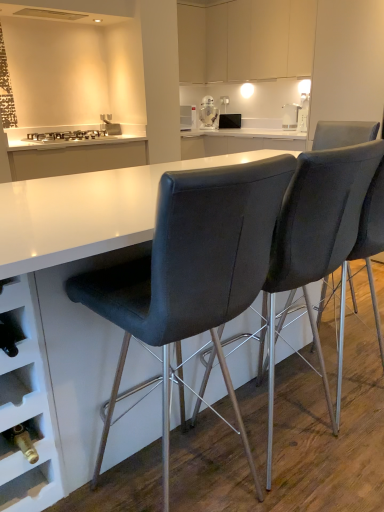
Question: Is white glossy stove at upper left thinner than matte black microwave at center, the first appliance when ordered from right to left?

Choices:
 (A) no
 (B) yes

Answer: (A)

Question: Considering the relative sizes of white glossy stove at upper left and matte black microwave at center, the 2th appliance from the left, in the image provided, is white glossy stove at upper left bigger than matte black microwave at center, the 2th appliance from the left,?

Choices:
 (A) no
 (B) yes

Answer: (B)

Question: Considering the relative positions of white glossy stove at upper left and matte black microwave at center, the first appliance when ordered from right to left, in the image provided, is white glossy stove at upper left in front of matte black microwave at center, the first appliance when ordered from right to left,?

Choices:
 (A) no
 (B) yes

Answer: (B)

Question: Is white glossy stove at upper left facing towards matte black microwave at center, the first appliance when ordered from right to left?

Choices:
 (A) no
 (B) yes

Answer: (A)

Question: Considering the relative sizes of white glossy stove at upper left and matte black microwave at center, the first appliance when ordered from right to left, in the image provided, is white glossy stove at upper left shorter than matte black microwave at center, the first appliance when ordered from right to left,?

Choices:
 (A) no
 (B) yes

Answer: (B)

Question: From a real-world perspective, is white glossy toaster at upper right positioned above or below white glossy stove at upper left?

Choices:
 (A) above
 (B) below

Answer: (A)

Question: Is point (286, 124) positioned closer to the camera than point (56, 136)?

Choices:
 (A) farther
 (B) closer

Answer: (A)

Question: Looking at their shapes, would you say white glossy toaster at upper right is wider or thinner than white glossy stove at upper left?

Choices:
 (A) thin
 (B) wide

Answer: (A)

Question: In terms of height, does white glossy toaster at upper right look taller or shorter compared to white glossy stove at upper left?

Choices:
 (A) tall
 (B) short

Answer: (A)

Question: Looking at their shapes, would you say matte white cabinets at upper center is wider or thinner than matte black microwave at center, the 2th appliance from the left?

Choices:
 (A) thin
 (B) wide

Answer: (B)

Question: Relative to matte black microwave at center, the 2th appliance from the left, is matte white cabinets at upper center in front or behind?

Choices:
 (A) front
 (B) behind

Answer: (A)

Question: In terms of size, does matte white cabinets at upper center appear bigger or smaller than matte black microwave at center, the 2th appliance from the left?

Choices:
 (A) big
 (B) small

Answer: (A)

Question: Is matte white cabinets at upper center spatially inside matte black microwave at center, the first appliance when ordered from right to left, or outside of it?

Choices:
 (A) outside
 (B) inside

Answer: (A)

Question: Considering the positions of matte black microwave at center, the first appliance when ordered from right to left, and white glossy r2-d2 droid at upper center, which ranks as the 1th appliance in left-to-right order, in the image, is matte black microwave at center, the first appliance when ordered from right to left, wider or thinner than white glossy r2-d2 droid at upper center, which ranks as the 1th appliance in left-to-right order,?

Choices:
 (A) wide
 (B) thin

Answer: (B)

Question: Is matte black microwave at center, the 2th appliance from the left, taller or shorter than white glossy r2-d2 droid at upper center, which ranks as the 1th appliance in left-to-right order?

Choices:
 (A) tall
 (B) short

Answer: (B)